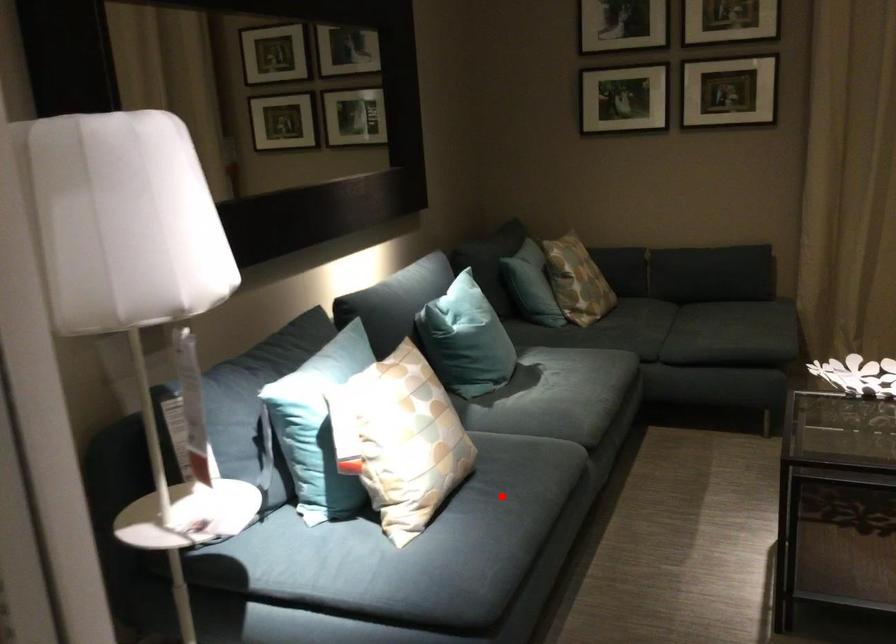
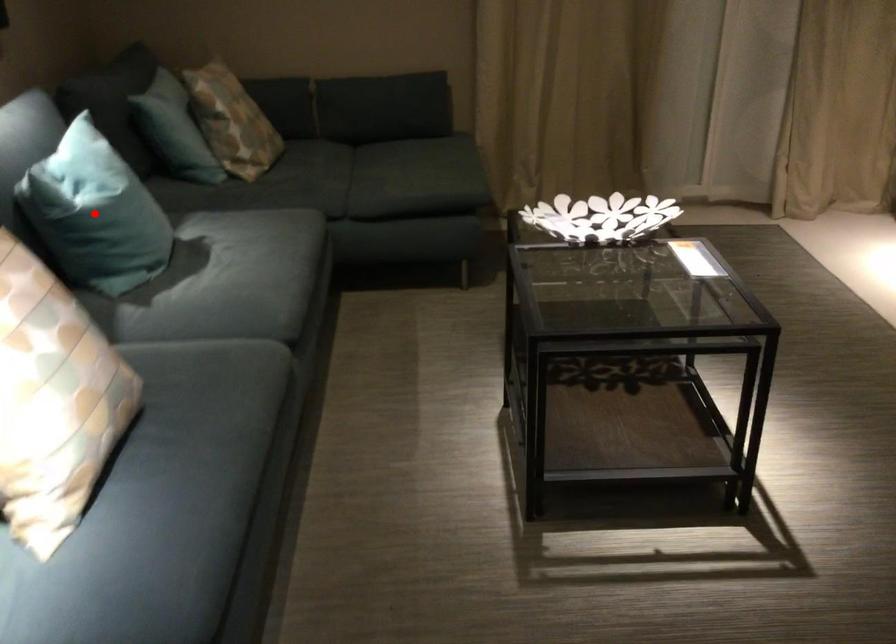
I am providing you with two images of the same scene from different viewpoints. A red point is marked on the first image and another point is marked on the second image. Do the highlighted points in image1 and image2 indicate the same real-world spot?

No